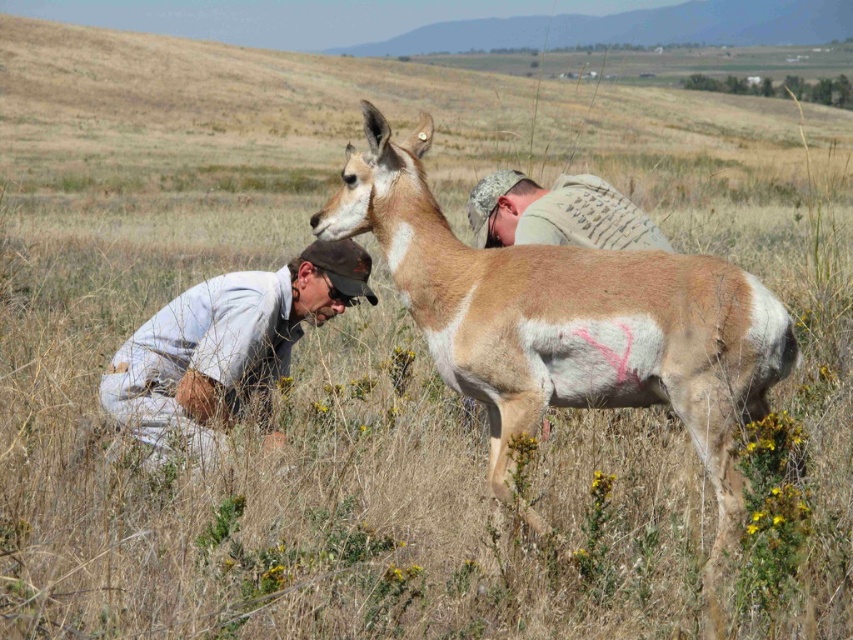
Question: Which object is positioned farthest from the gray fabric shirt at lower left?

Choices:
 (A) camouflage fabric vest at upper center
 (B) light brown fur at center

Answer: (A)

Question: Does light brown fur at center appear over camouflage fabric vest at upper center?

Choices:
 (A) yes
 (B) no

Answer: (B)

Question: Does light brown fur at center have a larger size compared to gray fabric shirt at lower left?

Choices:
 (A) no
 (B) yes

Answer: (B)

Question: Can you confirm if light brown fur at center is bigger than gray fabric shirt at lower left?

Choices:
 (A) yes
 (B) no

Answer: (A)

Question: Which point is closer to the camera taking this photo?

Choices:
 (A) (619, 237)
 (B) (595, 296)
 (C) (177, 340)

Answer: (B)

Question: Which point is farther to the camera?

Choices:
 (A) (642, 301)
 (B) (621, 212)
 (C) (131, 368)

Answer: (C)